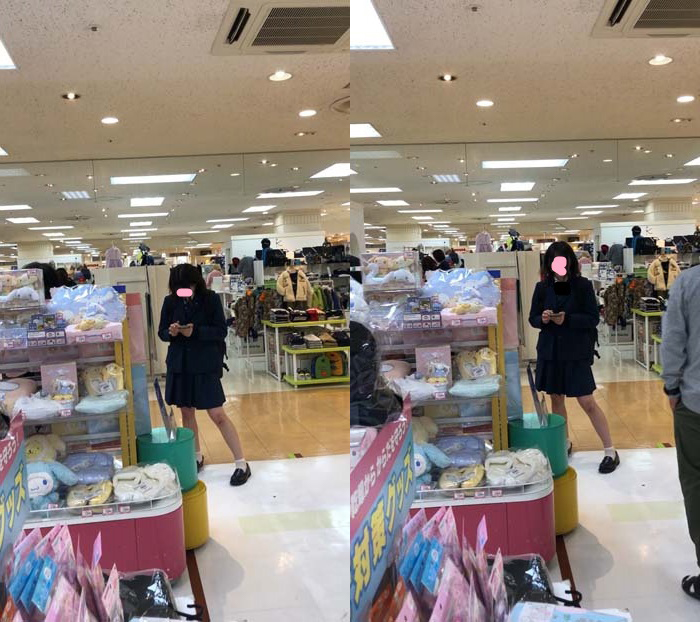
Image resolution: width=700 pixels, height=622 pixels. I want to click on vent, so click(x=299, y=30).